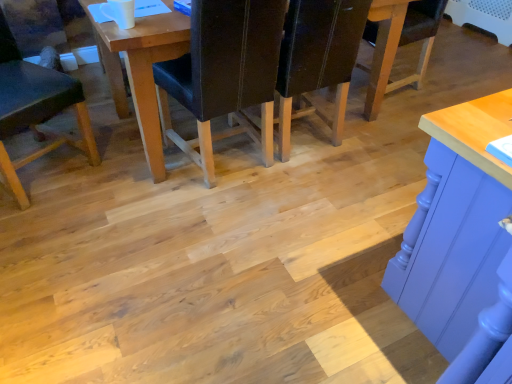
You are a GUI agent. You are given a task and a screenshot of the screen. Output one action in this format:
    pyautogui.click(x=<x>, y=<y>)
    Task: Click on the vacant point to the right of black leather chair at center, marked as the 2th chair in a right-to-left arrangement
    
    Given the screenshot: What is the action you would take?
    pyautogui.click(x=333, y=189)